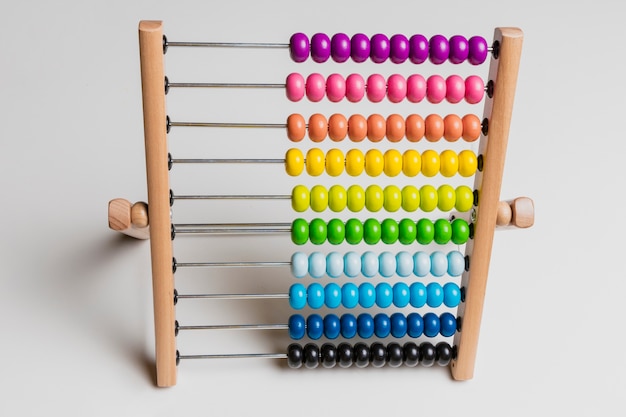
Find the location of a particular element. The image size is (626, 417). stand legs is located at coordinates [131, 217], [521, 212], [480, 241], [163, 326].